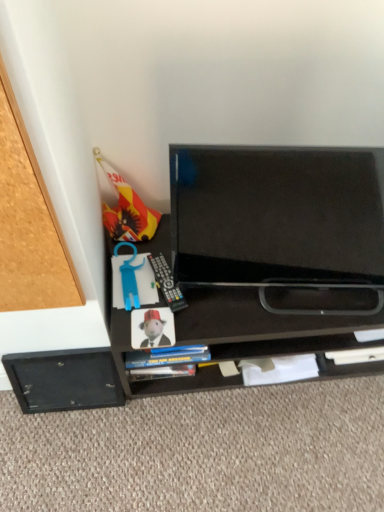
At what (x,y) coordinates should I click in order to perform the action: click on vacant space behind matte paper book at center. Please return your answer as a coordinate pair (x, y). This screenshot has height=512, width=384. Looking at the image, I should click on (144, 276).